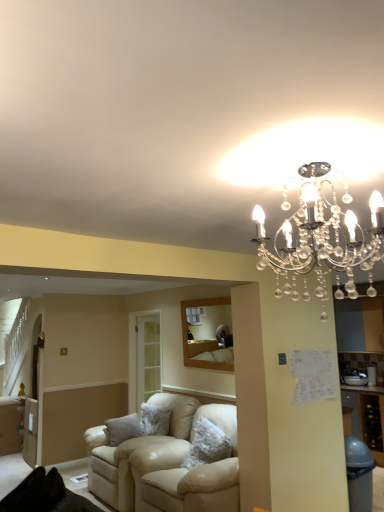
The image size is (384, 512). In order to click on beige leather couch at center in this screenshot , I will do `click(166, 464)`.

Describe the element at coordinates (166, 464) in the screenshot. I see `beige leather couch at center` at that location.

Measure the distance between clear crystal chandelier at upper center and camera.

They are 4.57 feet apart.

This screenshot has width=384, height=512. I want to click on clear crystal chandelier at upper center, so click(321, 239).

The image size is (384, 512). Describe the element at coordinates (321, 239) in the screenshot. I see `clear crystal chandelier at upper center` at that location.

Identify the location of beige leather couch at center. (166, 464).

Between beige leather couch at center and clear crystal chandelier at upper center, which one appears on the right side from the viewer's perspective?

Positioned to the right is clear crystal chandelier at upper center.

Is beige leather couch at center positioned in front of clear crystal chandelier at upper center?

No, it is behind clear crystal chandelier at upper center.

Does point (141, 447) come farther from viewer compared to point (315, 228)?

Yes, point (141, 447) is behind point (315, 228).

From the image's perspective, is beige leather couch at center under clear crystal chandelier at upper center?

Indeed, from the image's perspective, beige leather couch at center is shown beneath clear crystal chandelier at upper center.

Based on the photo, from a real-world perspective, which object rests below the other?

In real-world perspective, beige leather couch at center is lower.

In terms of width, does beige leather couch at center look wider or thinner when compared to clear crystal chandelier at upper center?

beige leather couch at center is wider than clear crystal chandelier at upper center.

Which of these two, beige leather couch at center or clear crystal chandelier at upper center, stands taller?

Standing taller between the two is beige leather couch at center.

Considering the sizes of objects beige leather couch at center and clear crystal chandelier at upper center in the image provided, who is bigger, beige leather couch at center or clear crystal chandelier at upper center?

beige leather couch at center.

Would you say beige leather couch at center contains clear crystal chandelier at upper center?

No, clear crystal chandelier at upper center is not inside beige leather couch at center.

Looking at this image, is there a large distance between beige leather couch at center and clear crystal chandelier at upper center?

Yes, beige leather couch at center and clear crystal chandelier at upper center are quite far apart.

Is beige leather couch at center looking in the opposite direction of clear crystal chandelier at upper center?

No, beige leather couch at center is not facing away from clear crystal chandelier at upper center.

Can you tell me how much beige leather couch at center and clear crystal chandelier at upper center differ in facing direction?

The facing directions of beige leather couch at center and clear crystal chandelier at upper center are 175 degrees apart.

The height and width of the screenshot is (512, 384). I want to click on studio couch on the left side of clear crystal chandelier at upper center, so click(x=166, y=464).

Based on their positions, is clear crystal chandelier at upper center located to the left or right of beige leather couch at center?

Based on their positions, clear crystal chandelier at upper center is located to the right of beige leather couch at center.

Which object is closer to the camera, clear crystal chandelier at upper center or beige leather couch at center?

clear crystal chandelier at upper center is in front.

Is point (279, 261) closer to viewer compared to point (90, 470)?

Yes, point (279, 261) is in front of point (90, 470).

From the image's perspective, which one is positioned lower, clear crystal chandelier at upper center or beige leather couch at center?

beige leather couch at center.

From a real-world perspective, which object rests below the other?

beige leather couch at center, from a real-world perspective.

Between clear crystal chandelier at upper center and beige leather couch at center, which one has larger width?

Wider between the two is beige leather couch at center.

Considering the sizes of objects clear crystal chandelier at upper center and beige leather couch at center in the image provided, who is taller, clear crystal chandelier at upper center or beige leather couch at center?

beige leather couch at center is taller.

Considering the sizes of objects clear crystal chandelier at upper center and beige leather couch at center in the image provided, who is smaller, clear crystal chandelier at upper center or beige leather couch at center?

clear crystal chandelier at upper center is smaller.

Does clear crystal chandelier at upper center contain beige leather couch at center?

No, beige leather couch at center is not surrounded by clear crystal chandelier at upper center.

Does clear crystal chandelier at upper center touch beige leather couch at center?

They are not placed beside each other.

Does clear crystal chandelier at upper center turn towards beige leather couch at center?

No.

What's the angular difference between clear crystal chandelier at upper center and beige leather couch at center's facing directions?

There is a 175-degree angle between the facing directions of clear crystal chandelier at upper center and beige leather couch at center.

The width and height of the screenshot is (384, 512). Find the location of `lamp above the beige leather couch at center (from a real-world perspective)`. lamp above the beige leather couch at center (from a real-world perspective) is located at coordinates (321, 239).

Image resolution: width=384 pixels, height=512 pixels. In order to click on lamp located above the beige leather couch at center (from a real-world perspective) in this screenshot , I will do `click(321, 239)`.

Locate an element on the screen. The height and width of the screenshot is (512, 384). studio couch that appears below the clear crystal chandelier at upper center (from a real-world perspective) is located at coordinates (166, 464).